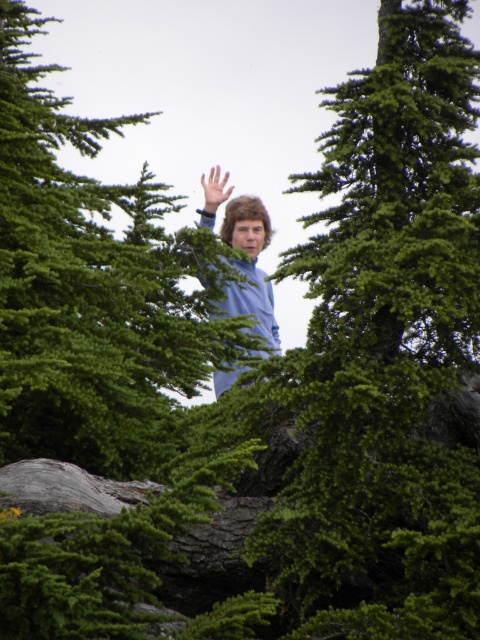
Question: Can you confirm if green textured tree at center is positioned to the right of smooth skin hand at center?

Choices:
 (A) no
 (B) yes

Answer: (A)

Question: Does green textured tree at center appear on the left side of smooth skin hand at center?

Choices:
 (A) no
 (B) yes

Answer: (B)

Question: Does green textured tree at center appear on the right side of smooth skin hand at center?

Choices:
 (A) yes
 (B) no

Answer: (B)

Question: Among these points, which one is nearest to the camera?

Choices:
 (A) coord(144,170)
 (B) coord(224,182)

Answer: (A)

Question: Which point is closer to the camera?

Choices:
 (A) (204, 186)
 (B) (3, 269)

Answer: (B)

Question: Which of the following is the farthest from the observer?

Choices:
 (A) smooth skin hand at center
 (B) green textured tree at center

Answer: (A)